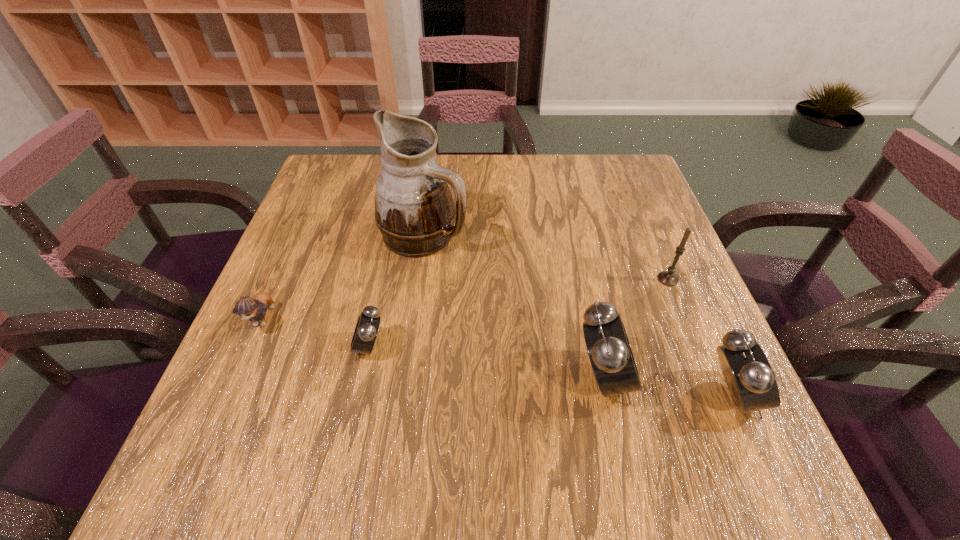
Where is `free space at the left edge of the desktop`? Image resolution: width=960 pixels, height=540 pixels. free space at the left edge of the desktop is located at coordinates (294, 275).

You are a GUI agent. You are given a task and a screenshot of the screen. Output one action in this format:
    pyautogui.click(x=<x>, y=<y>)
    Task: Click on the free region at the right edge of the desktop
    This screenshot has width=960, height=540.
    Given the screenshot: What is the action you would take?
    click(660, 252)

In the image, there is a desktop. Identify the location of vacant space at the far left corner. (337, 185).

The height and width of the screenshot is (540, 960). Identify the location of free region at the near left corner of the desktop. (244, 424).

In order to click on blank area at the far right corner in this screenshot , I will do [601, 177].

Locate an element on the screen. This screenshot has width=960, height=540. vacant area between the shortest alarm clock and the third object from right to left is located at coordinates (x=487, y=362).

This screenshot has height=540, width=960. Identify the location of free space that is in between the candle and the tallest object. (546, 257).

This screenshot has height=540, width=960. In order to click on free space between the rightmost alarm clock and the candle in this screenshot , I will do `click(700, 337)`.

Find the location of `free area in between the rightmost alarm clock and the tallest object`. free area in between the rightmost alarm clock and the tallest object is located at coordinates point(578,315).

At what (x,y) coordinates should I click in order to perform the action: click on unoccupied position between the leftmost object and the shortest alarm clock. Please return your answer as a coordinate pair (x, y). The image size is (960, 540). Looking at the image, I should click on (317, 330).